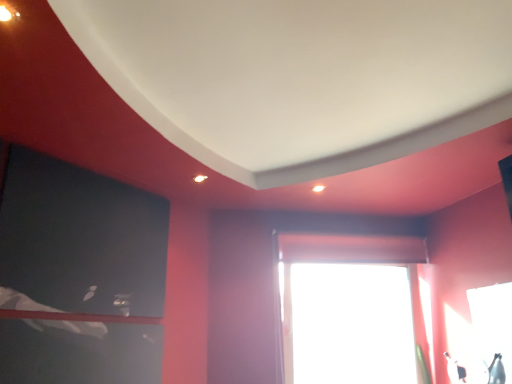
The image size is (512, 384). What do you see at coordinates (351, 248) in the screenshot? I see `translucent fabric curtain at center` at bounding box center [351, 248].

This screenshot has width=512, height=384. I want to click on translucent fabric curtain at center, so click(351, 248).

What is the approximate height of translucent fabric curtain at center?

29.34 centimeters.

The height and width of the screenshot is (384, 512). Find the location of `translucent fabric curtain at center`. translucent fabric curtain at center is located at coordinates (351, 248).